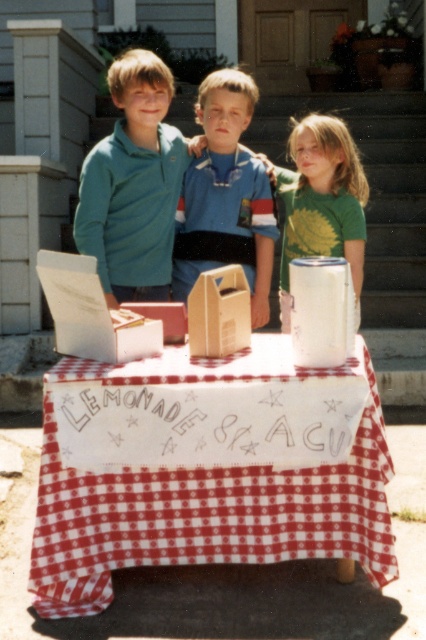
Does red checkered tablecloth at center have a larger size compared to blue fabric shirt at center?

Correct, red checkered tablecloth at center is larger in size than blue fabric shirt at center.

Is red checkered tablecloth at center positioned behind blue fabric shirt at center?

No, red checkered tablecloth at center is in front of blue fabric shirt at center.

Image resolution: width=426 pixels, height=640 pixels. What do you see at coordinates (203, 508) in the screenshot? I see `red checkered tablecloth at center` at bounding box center [203, 508].

At what (x,y) coordinates should I click in order to perform the action: click on red checkered tablecloth at center. Please return your answer as a coordinate pair (x, y). Looking at the image, I should click on (203, 508).

Who is lower down, red checkered tablecloth at center or green matte shirt at center?

Positioned lower is red checkered tablecloth at center.

Which of these two, red checkered tablecloth at center or green matte shirt at center, stands taller?

red checkered tablecloth at center

Between point (230, 486) and point (365, 193), which one is positioned behind?

The point (365, 193) is more distant.

The height and width of the screenshot is (640, 426). In order to click on red checkered tablecloth at center in this screenshot , I will do `click(203, 508)`.

Can you confirm if blue fabric shirt at center is positioned above teal fleece jacket at upper left?

Incorrect, blue fabric shirt at center is not positioned above teal fleece jacket at upper left.

Which is more to the left, blue fabric shirt at center or teal fleece jacket at upper left?

From the viewer's perspective, teal fleece jacket at upper left appears more on the left side.

Does point (207, 236) lie behind point (166, 172)?

That is True.

The image size is (426, 640). I want to click on blue fabric shirt at center, so click(226, 196).